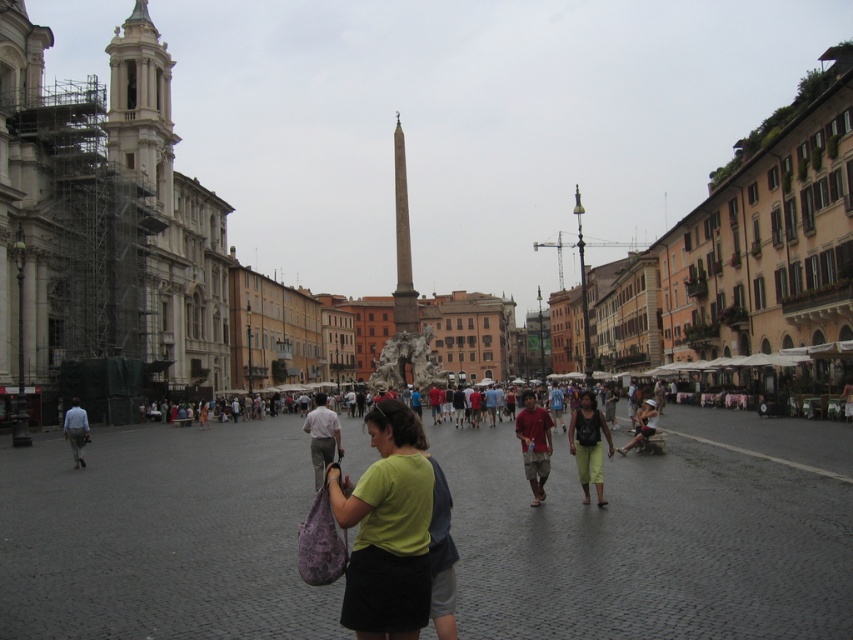
Question: Which of the following is the closest to the observer?

Choices:
 (A) (73, 413)
 (B) (315, 476)

Answer: (B)

Question: Can you confirm if green matte shirt at center is positioned above matte red t-shirt at center?

Choices:
 (A) yes
 (B) no

Answer: (B)

Question: Can you confirm if matte red t-shirt at center is positioned below light blue shirt at center?

Choices:
 (A) yes
 (B) no

Answer: (B)

Question: Considering the real-world distances, which object is farthest from the matte black shirt at center?

Choices:
 (A) matte red t-shirt at center
 (B) green matte shirt at center

Answer: (B)

Question: Which point appears farthest from the camera in this image?

Choices:
 (A) (341, 509)
 (B) (79, 456)

Answer: (B)

Question: Is light brown cotton shirt at center wider than light blue shirt at center?

Choices:
 (A) no
 (B) yes

Answer: (B)